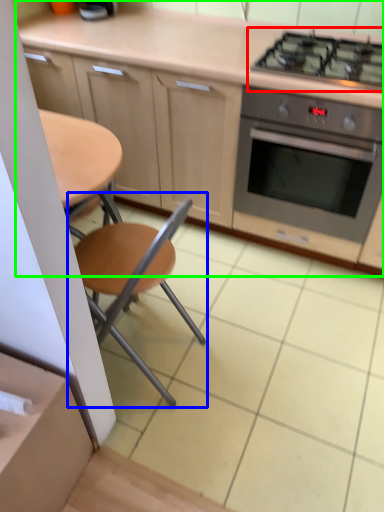
Question: Which object is positioned farthest from gas stove (highlighted by a red box)? Select from chair (highlighted by a blue box) and cabinetry (highlighted by a green box).

Choices:
 (A) chair
 (B) cabinetry

Answer: (A)